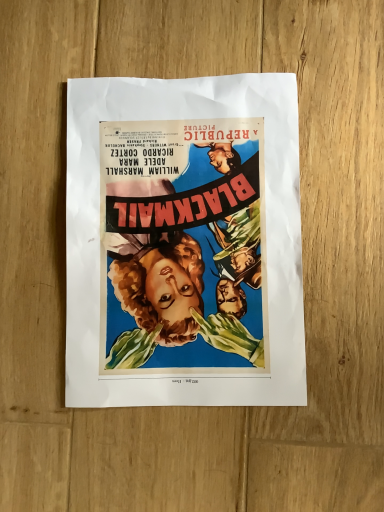
Identify the location of free space above vibrant paper poster at center (from a real-world perspective). (182, 233).